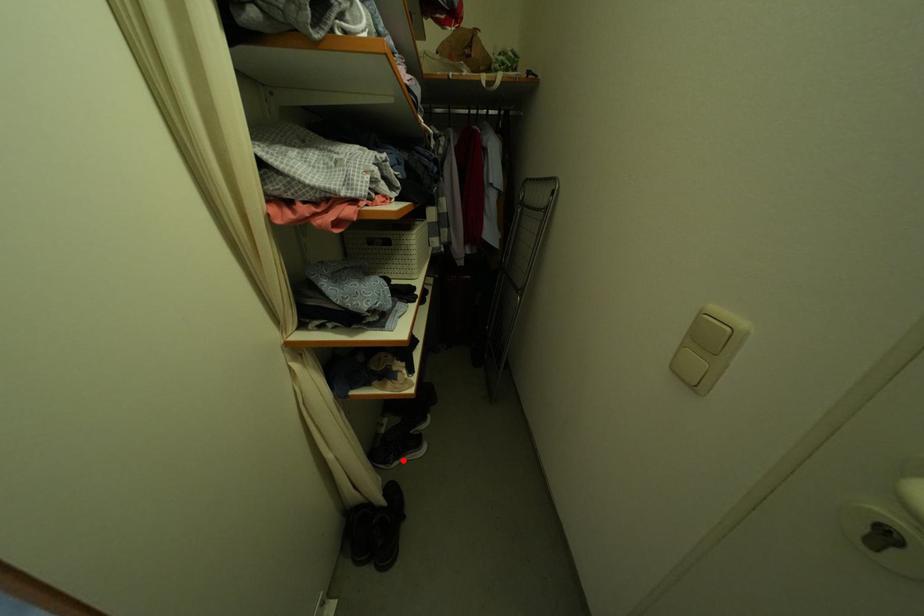
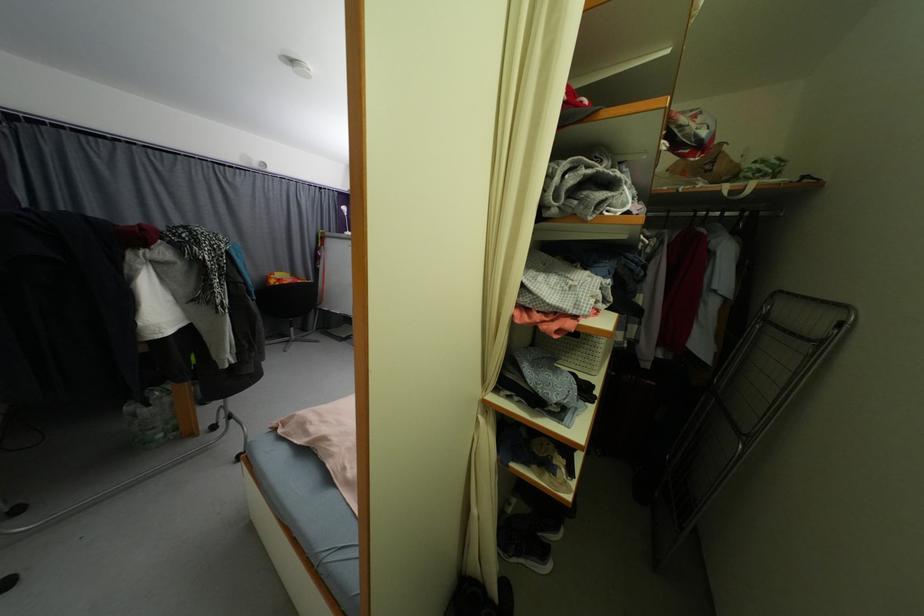
Where in the second image is the point corresponding to the highlighted location from the first image?

(524, 557)